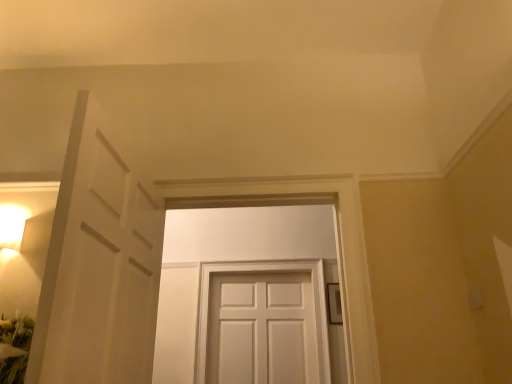
The width and height of the screenshot is (512, 384). What do you see at coordinates (261, 329) in the screenshot? I see `white matte door at center, acting as the 1th door starting from the bottom` at bounding box center [261, 329].

Locate an element on the screen. This screenshot has width=512, height=384. white matte door at center, the 2th door viewed from the front is located at coordinates (261, 329).

In order to face white matte door at center, the second door in the bottom-to-top sequence, should I rotate leftwards or rightwards?

You should look left and rotate roughly 1.555 degrees.

Image resolution: width=512 pixels, height=384 pixels. What do you see at coordinates (226, 260) in the screenshot?
I see `white matte door at center, which is the 1th door from front to back` at bounding box center [226, 260].

The width and height of the screenshot is (512, 384). In order to click on white matte door at center, the 1th door from the top in this screenshot , I will do `click(226, 260)`.

Identify the location of white matte door at center, which appears as the first door when viewed from the back. The width and height of the screenshot is (512, 384). (261, 329).

From the picture: Considering the positions of objects white matte door at center, the second door positioned from the back, and white matte door at center, which appears as the first door when viewed from the back, in the image provided, who is more to the left, white matte door at center, the second door positioned from the back, or white matte door at center, which appears as the first door when viewed from the back,?

white matte door at center, the second door positioned from the back, is more to the left.

In the image, is white matte door at center, the 1th door from the top, positioned in front of or behind white matte door at center, the 2th door in the top-to-bottom sequence?

Clearly, white matte door at center, the 1th door from the top, is in front of white matte door at center, the 2th door in the top-to-bottom sequence.

Which is behind, point (186, 291) or point (298, 291)?

Positioned behind is point (298, 291).

From the image's perspective, which is below, white matte door at center, the second door positioned from the back, or white matte door at center, the 2th door viewed from the front?

white matte door at center, the 2th door viewed from the front, from the image's perspective.

From a real-world perspective, is white matte door at center, the 1th door from the top, physically located above or below white matte door at center, the 2th door viewed from the front?

From a real-world perspective, white matte door at center, the 1th door from the top, is physically above white matte door at center, the 2th door viewed from the front.

Considering the sizes of objects white matte door at center, the 1th door from the top, and white matte door at center, acting as the 1th door starting from the bottom, in the image provided, who is wider, white matte door at center, the 1th door from the top, or white matte door at center, acting as the 1th door starting from the bottom,?

white matte door at center, the 1th door from the top.

Consider the image. Which of these two, white matte door at center, which is the 1th door from front to back, or white matte door at center, the 2th door viewed from the front, stands taller?

Standing taller between the two is white matte door at center, which is the 1th door from front to back.

Based on their sizes in the image, would you say white matte door at center, which is the 1th door from front to back, is bigger or smaller than white matte door at center, the 2th door in the top-to-bottom sequence?

Considering their sizes, white matte door at center, which is the 1th door from front to back, takes up more space than white matte door at center, the 2th door in the top-to-bottom sequence.

Is white matte door at center, the 1th door from the top, not within white matte door at center, which appears as the first door when viewed from the back?

Yes, white matte door at center, the 1th door from the top, is outside of white matte door at center, which appears as the first door when viewed from the back.

Is white matte door at center, which is the 1th door from front to back, touching white matte door at center, which appears as the first door when viewed from the back?

No, white matte door at center, which is the 1th door from front to back, is not making contact with white matte door at center, which appears as the first door when viewed from the back.

Is white matte door at center, the 1th door from the top, oriented away from white matte door at center, the 2th door in the top-to-bottom sequence?

Absolutely, white matte door at center, the 1th door from the top, is directed away from white matte door at center, the 2th door in the top-to-bottom sequence.

How much distance is there between white matte door at center, which is the 1th door from front to back, and white matte door at center, which appears as the first door when viewed from the back?

white matte door at center, which is the 1th door from front to back, and white matte door at center, which appears as the first door when viewed from the back, are 43.16 centimeters apart.

The width and height of the screenshot is (512, 384). In order to click on door lying below the white matte door at center, which is the 1th door from front to back (from the image's perspective) in this screenshot , I will do `click(261, 329)`.

Considering the positions of objects white matte door at center, which appears as the first door when viewed from the back, and white matte door at center, the 1th door from the top, in the image provided, who is more to the left, white matte door at center, which appears as the first door when viewed from the back, or white matte door at center, the 1th door from the top,?

From the viewer's perspective, white matte door at center, the 1th door from the top, appears more on the left side.

Considering the positions of objects white matte door at center, acting as the 1th door starting from the bottom, and white matte door at center, which is the 1th door from front to back, in the image provided, who is behind, white matte door at center, acting as the 1th door starting from the bottom, or white matte door at center, which is the 1th door from front to back,?

white matte door at center, acting as the 1th door starting from the bottom, is more distant.

Which point is more forward, (260, 358) or (199, 217)?

Point (260, 358)

From the image's perspective, is white matte door at center, which appears as the first door when viewed from the back, on top of white matte door at center, the second door positioned from the back?

Actually, white matte door at center, which appears as the first door when viewed from the back, appears below white matte door at center, the second door positioned from the back, in the image.

From a real-world perspective, who is located higher, white matte door at center, acting as the 1th door starting from the bottom, or white matte door at center, the second door in the bottom-to-top sequence?

white matte door at center, the second door in the bottom-to-top sequence.

Considering the sizes of objects white matte door at center, the 2th door viewed from the front, and white matte door at center, which is the 1th door from front to back, in the image provided, who is wider, white matte door at center, the 2th door viewed from the front, or white matte door at center, which is the 1th door from front to back,?

Wider between the two is white matte door at center, which is the 1th door from front to back.

Is white matte door at center, the 2th door viewed from the front, shorter than white matte door at center, the second door in the bottom-to-top sequence?

Indeed, white matte door at center, the 2th door viewed from the front, has a lesser height compared to white matte door at center, the second door in the bottom-to-top sequence.

Considering the relative sizes of white matte door at center, the 2th door in the top-to-bottom sequence, and white matte door at center, the 1th door from the top, in the image provided, is white matte door at center, the 2th door in the top-to-bottom sequence, bigger than white matte door at center, the 1th door from the top,?

Actually, white matte door at center, the 2th door in the top-to-bottom sequence, might be smaller than white matte door at center, the 1th door from the top.

From the picture: Is white matte door at center, the second door positioned from the back, located within white matte door at center, the 2th door in the top-to-bottom sequence?

Definitely not — white matte door at center, the second door positioned from the back, is not inside white matte door at center, the 2th door in the top-to-bottom sequence.

Is there a large distance between white matte door at center, which appears as the first door when viewed from the back, and white matte door at center, the second door positioned from the back?

That's not correct — white matte door at center, which appears as the first door when viewed from the back, is a little close to white matte door at center, the second door positioned from the back.

Looking at this image, does white matte door at center, which appears as the first door when viewed from the back, turn towards white matte door at center, which is the 1th door from front to back?

Yes.

From the picture: How different are the orientations of white matte door at center, which appears as the first door when viewed from the back, and white matte door at center, the second door in the bottom-to-top sequence, in degrees?

1.96 degrees.

How distant is white matte door at center, acting as the 1th door starting from the bottom, from white matte door at center, which is the 1th door from front to back?

They are 16.99 inches apart.

Locate an element on the screen. The height and width of the screenshot is (384, 512). door on the right side of white matte door at center, the second door in the bottom-to-top sequence is located at coordinates (261, 329).

This screenshot has height=384, width=512. Find the location of `door in front of the white matte door at center, the 2th door in the top-to-bottom sequence`. door in front of the white matte door at center, the 2th door in the top-to-bottom sequence is located at coordinates (226, 260).

Find the location of a particular element. The width and height of the screenshot is (512, 384). door lying above the white matte door at center, which appears as the first door when viewed from the back (from the image's perspective) is located at coordinates (226, 260).